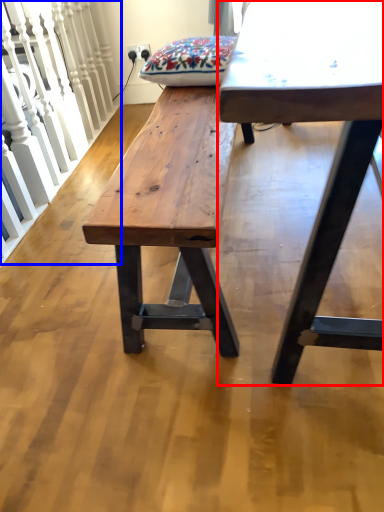
Question: Which point is closer to the camera, table (highlighted by a red box) or rail (highlighted by a blue box)?

Choices:
 (A) table
 (B) rail

Answer: (A)